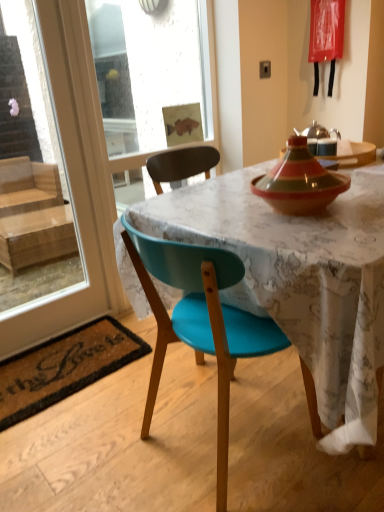
Question: From a real-world perspective, relative to coir mat at lower left, is matte ceramic tagine at upper right vertically above or below?

Choices:
 (A) below
 (B) above

Answer: (B)

Question: Is matte ceramic tagine at upper right inside or outside of coir mat at lower left?

Choices:
 (A) inside
 (B) outside

Answer: (B)

Question: Which object is the farthest from the coir mat at lower left?

Choices:
 (A) matte ceramic tagine at upper right
 (B) transparent glass door at left
 (C) teal plastic chair at center
 (D) transparent glass screen door at upper left

Answer: (D)

Question: Which is nearer to the coir mat at lower left?

Choices:
 (A) teal plastic chair at center
 (B) matte ceramic tagine at upper right
 (C) transparent glass door at left
 (D) transparent glass screen door at upper left

Answer: (A)